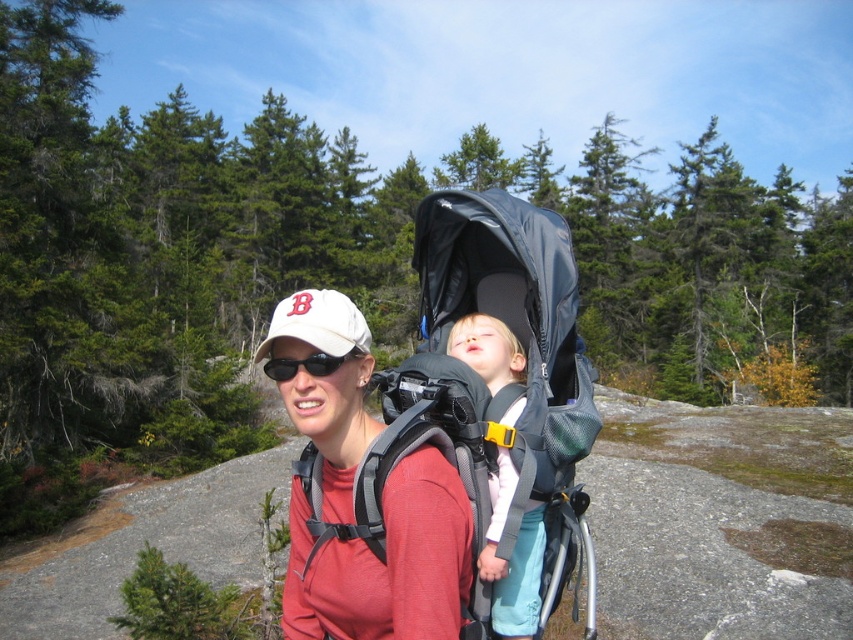
Question: Which point appears closest to the camera in this image?

Choices:
 (A) (x=570, y=296)
 (B) (x=490, y=493)

Answer: (B)

Question: Is matte red shirt at center closer to camera compared to light pink fabric sleeping bag at center?

Choices:
 (A) no
 (B) yes

Answer: (B)

Question: Can you confirm if matte black stroller at center is positioned to the right of matte red shirt at center?

Choices:
 (A) yes
 (B) no

Answer: (A)

Question: Which is farther from the matte red shirt at center?

Choices:
 (A) matte black stroller at center
 (B) white matte baseball cap at center
 (C) light pink fabric sleeping bag at center
 (D) black matte sunglasses at center

Answer: (B)

Question: Which object appears closest to the camera in this image?

Choices:
 (A) black matte sunglasses at center
 (B) light pink fabric sleeping bag at center
 (C) matte black stroller at center

Answer: (A)

Question: Can you confirm if matte black stroller at center is positioned to the left of white matte baseball cap at center?

Choices:
 (A) no
 (B) yes

Answer: (A)